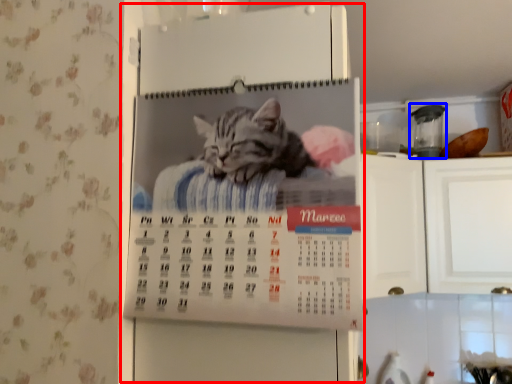
Question: Which object appears farthest to the camera in this image, appliance (highlighted by a red box) or appliance (highlighted by a blue box)?

Choices:
 (A) appliance
 (B) appliance

Answer: (B)